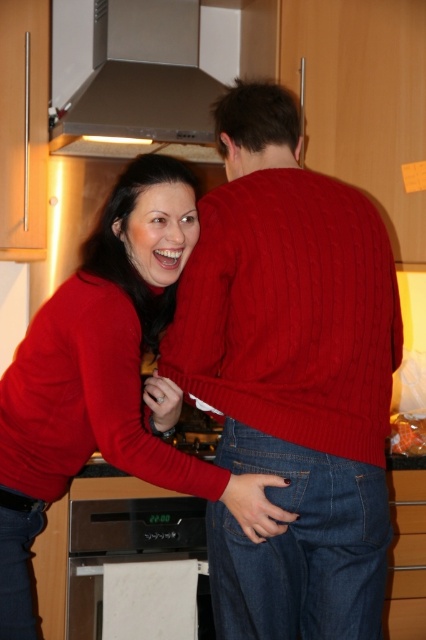
Who is taller, cable-knit sweater at center or black glossy oven at lower center?

cable-knit sweater at center

Can you confirm if cable-knit sweater at center is taller than black glossy oven at lower center?

Correct, cable-knit sweater at center is much taller as black glossy oven at lower center.

Image resolution: width=426 pixels, height=640 pixels. What do you see at coordinates (291, 376) in the screenshot?
I see `cable-knit sweater at center` at bounding box center [291, 376].

Image resolution: width=426 pixels, height=640 pixels. Find the location of `cable-knit sweater at center`. cable-knit sweater at center is located at coordinates (291, 376).

Is cable-knit sweater at center closer to the viewer compared to satin silver exhaust hood at upper center?

Yes, cable-knit sweater at center is in front of satin silver exhaust hood at upper center.

Does cable-knit sweater at center have a lesser width compared to satin silver exhaust hood at upper center?

Yes, cable-knit sweater at center is thinner than satin silver exhaust hood at upper center.

Is point (226, 246) farther from camera compared to point (103, 113)?

No, (226, 246) is closer to viewer.

The image size is (426, 640). What are the coordinates of `cable-knit sweater at center` in the screenshot? It's located at (291, 376).

Can you confirm if cable-knit sweater at center is positioned above matte red sweater at center?

Correct, cable-knit sweater at center is located above matte red sweater at center.

Who is lower down, cable-knit sweater at center or matte red sweater at center?

matte red sweater at center is below.

Is point (379, 484) positioned in front of point (293, 516)?

No.

The height and width of the screenshot is (640, 426). In order to click on cable-knit sweater at center in this screenshot , I will do `click(291, 376)`.